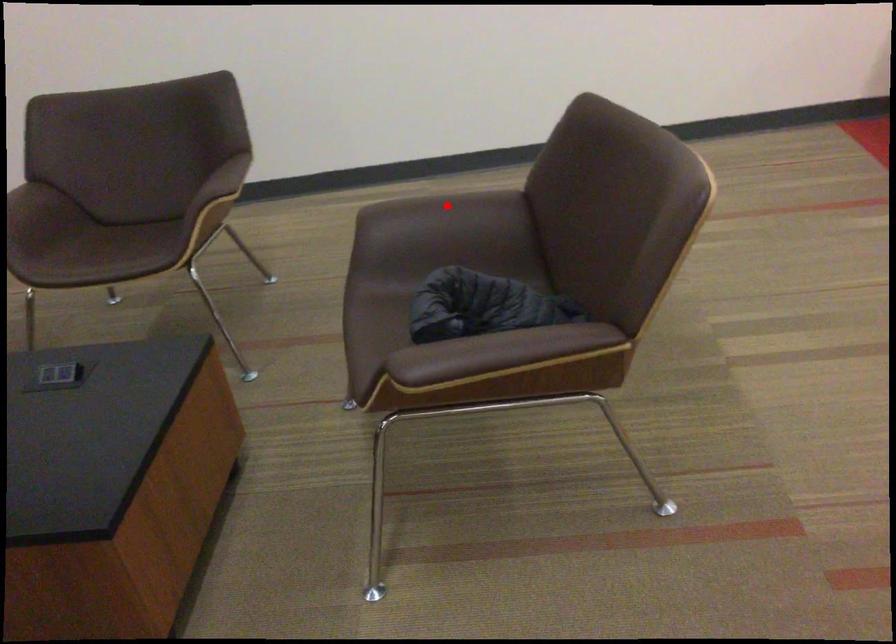
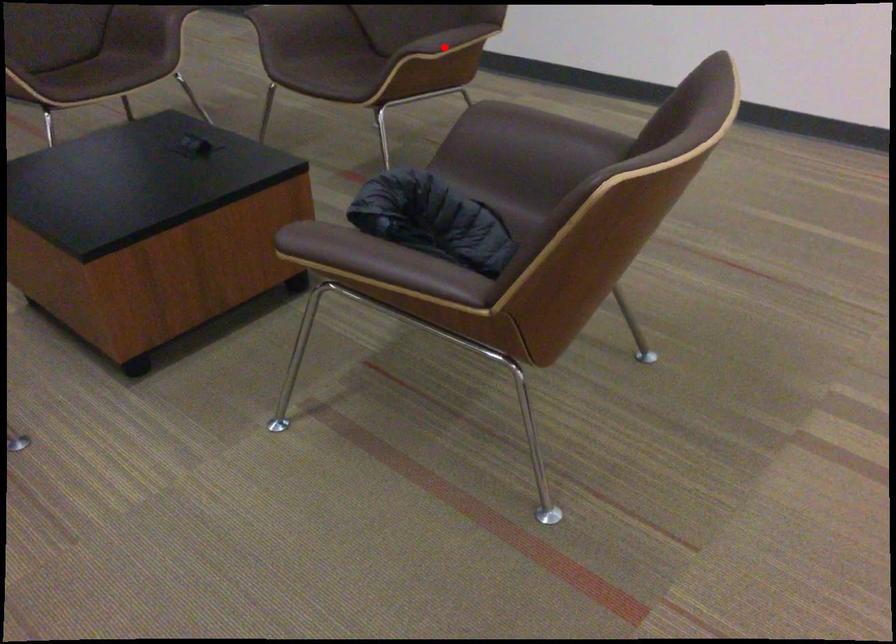
I am providing you with two images of the same scene from different viewpoints. A red point is marked on the first image and another point is marked on the second image. Is the red point in image1 aligned with the point shown in image2?

No